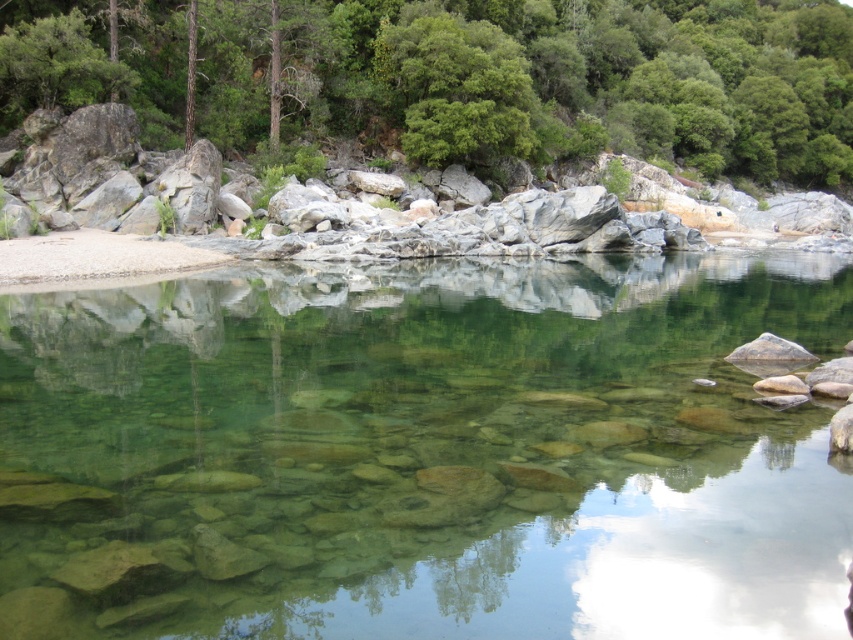
Question: Is clear glassy water at center to the right of green leafy tree at upper center from the viewer's perspective?

Choices:
 (A) no
 (B) yes

Answer: (A)

Question: Which object appears closest to the camera in this image?

Choices:
 (A) clear glassy water at center
 (B) green leafy tree at upper center

Answer: (A)

Question: Among these objects, which one is farthest from the camera?

Choices:
 (A) clear glassy water at center
 (B) green leafy tree at upper center

Answer: (B)

Question: Where is clear glassy water at center located in relation to green leafy tree at upper center in the image?

Choices:
 (A) left
 (B) right

Answer: (A)

Question: Considering the relative positions of clear glassy water at center and green leafy tree at upper center in the image provided, where is clear glassy water at center located with respect to green leafy tree at upper center?

Choices:
 (A) right
 (B) left

Answer: (B)